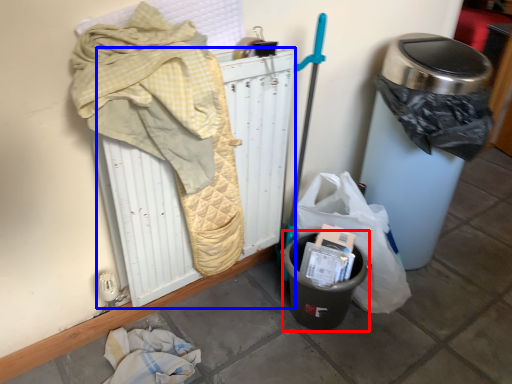
Question: Which object appears farthest to the camera in this image, recycling bin (highlighted by a red box) or radiator (highlighted by a blue box)?

Choices:
 (A) recycling bin
 (B) radiator

Answer: (A)